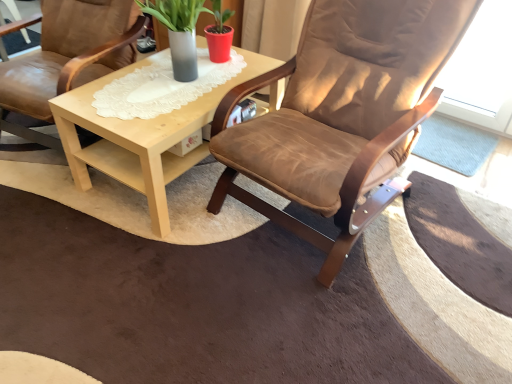
Locate an element on the screen. free space in front of brown suede chair at center, which appears as the first chair when viewed from the right is located at coordinates (325, 309).